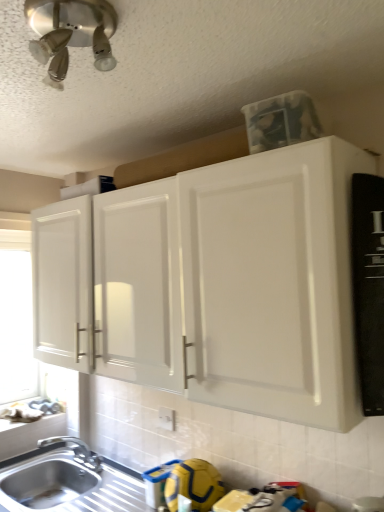
Question: From the image's perspective, is white matte cabinet at upper center positioned above or below satin nickel light fixture at upper left?

Choices:
 (A) above
 (B) below

Answer: (B)

Question: Is white matte cabinet at upper center situated inside satin nickel light fixture at upper left or outside?

Choices:
 (A) inside
 (B) outside

Answer: (B)

Question: Estimate the real-world distances between objects in this image. Which object is closer to the silver metallic faucet at lower left?

Choices:
 (A) white plastic electric outlet at lower center
 (B) stainless steel sink at lower left
 (C) satin nickel light fixture at upper left
 (D) white matte window screen at left
 (E) white matte window sill at lower left

Answer: (E)

Question: Based on their relative distances, which object is nearer to the white matte window sill at lower left?

Choices:
 (A) white matte cabinet at upper center
 (B) satin nickel light fixture at upper left
 (C) white plastic electric outlet at lower center
 (D) white matte window screen at left
 (E) silver metallic faucet at lower left

Answer: (E)